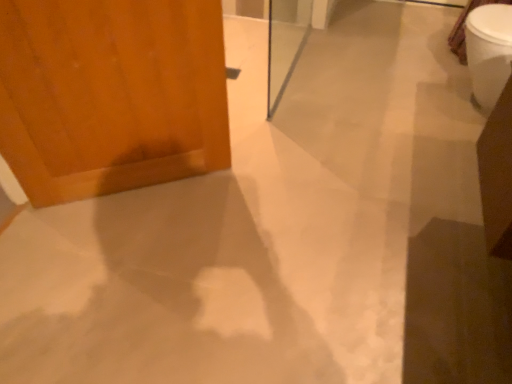
Question: From a real-world perspective, is wooden door at left on top of white glossy toilet bowl at upper right?

Choices:
 (A) yes
 (B) no

Answer: (A)

Question: Does wooden door at left lie behind white glossy toilet bowl at upper right?

Choices:
 (A) no
 (B) yes

Answer: (A)

Question: Can you confirm if wooden door at left is wider than white glossy toilet bowl at upper right?

Choices:
 (A) no
 (B) yes

Answer: (A)

Question: From the image's perspective, is wooden door at left beneath white glossy toilet bowl at upper right?

Choices:
 (A) no
 (B) yes

Answer: (B)

Question: Is wooden door at left facing away from white glossy toilet bowl at upper right?

Choices:
 (A) yes
 (B) no

Answer: (B)

Question: Is wooden door at left to the left of white glossy toilet bowl at upper right from the viewer's perspective?

Choices:
 (A) no
 (B) yes

Answer: (B)

Question: Is transparent glass screen door at center oriented away from wooden door at left?

Choices:
 (A) no
 (B) yes

Answer: (A)

Question: Does transparent glass screen door at center contain wooden door at left?

Choices:
 (A) yes
 (B) no

Answer: (B)

Question: From a real-world perspective, is transparent glass screen door at center under wooden door at left?

Choices:
 (A) no
 (B) yes

Answer: (B)

Question: Does transparent glass screen door at center have a lesser height compared to wooden door at left?

Choices:
 (A) no
 (B) yes

Answer: (B)

Question: Does transparent glass screen door at center touch wooden door at left?

Choices:
 (A) no
 (B) yes

Answer: (A)

Question: Is transparent glass screen door at center facing towards wooden door at left?

Choices:
 (A) no
 (B) yes

Answer: (A)

Question: Can you confirm if white glossy toilet bowl at upper right is wider than transparent glass screen door at center?

Choices:
 (A) no
 (B) yes

Answer: (B)